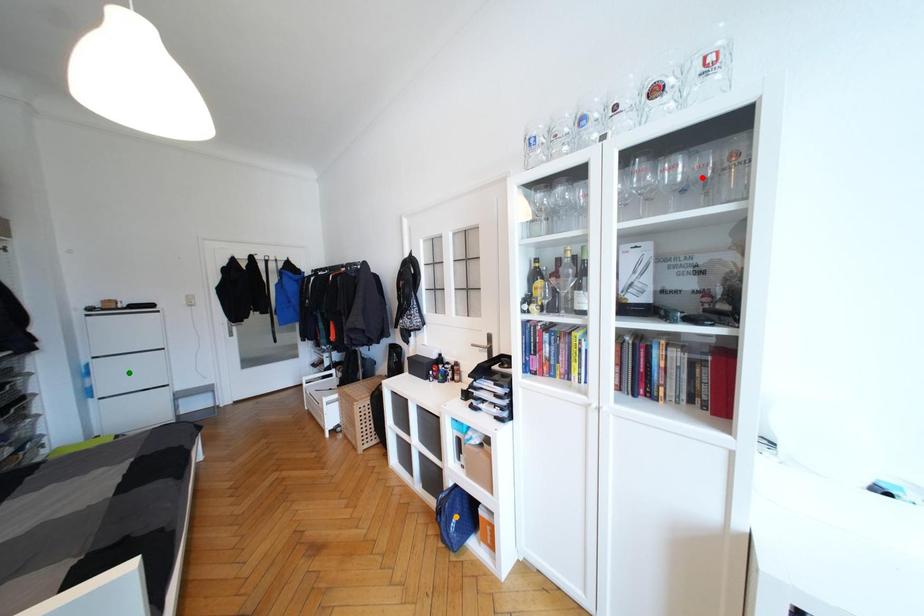
Order these from nearest to farthest:
red point
orange point
green point

red point < orange point < green point